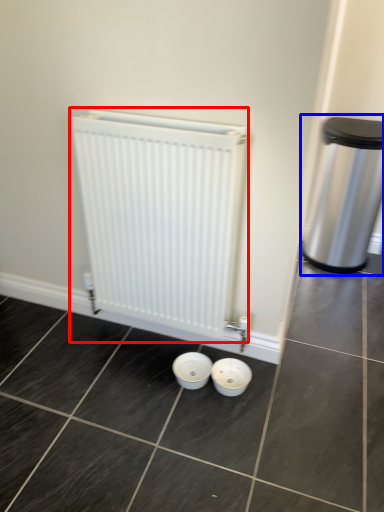
Question: Which of the following is the closest to the observer, radiator (highlighted by a red box) or waste container (highlighted by a blue box)?

Choices:
 (A) radiator
 (B) waste container

Answer: (A)